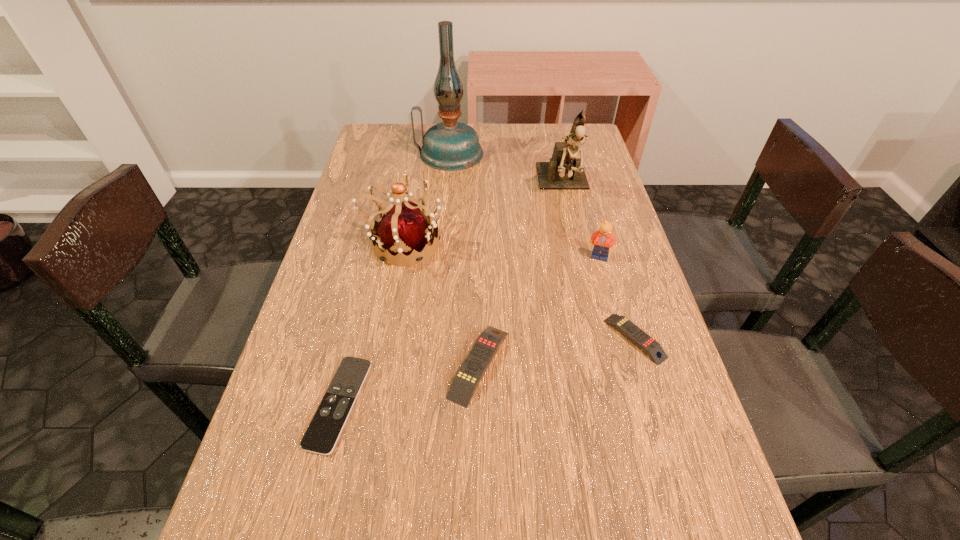
Where is `oil lamp`? Image resolution: width=960 pixels, height=540 pixels. oil lamp is located at coordinates (450, 145).

Find the location of `brown figurine`. brown figurine is located at coordinates (564, 171).

This screenshot has width=960, height=540. Find the location of `figurine`. figurine is located at coordinates (564, 171).

Find the location of a particular element. This screenshot has width=960, height=540. the fifth shortest object is located at coordinates (404, 229).

Image resolution: width=960 pixels, height=540 pixels. I want to click on tiara, so tap(404, 229).

Identify the location of the fourth shortest object. The image size is (960, 540). (604, 238).

Identify the location of Lego. (604, 238).

The height and width of the screenshot is (540, 960). I want to click on the tallest remote control, so click(468, 377).

Find the location of a particular element. The height and width of the screenshot is (540, 960). the left yellow remote control is located at coordinates (468, 377).

Locate an element on the screen. Image resolution: width=960 pixels, height=540 pixels. the rightmost remote control is located at coordinates (637, 336).